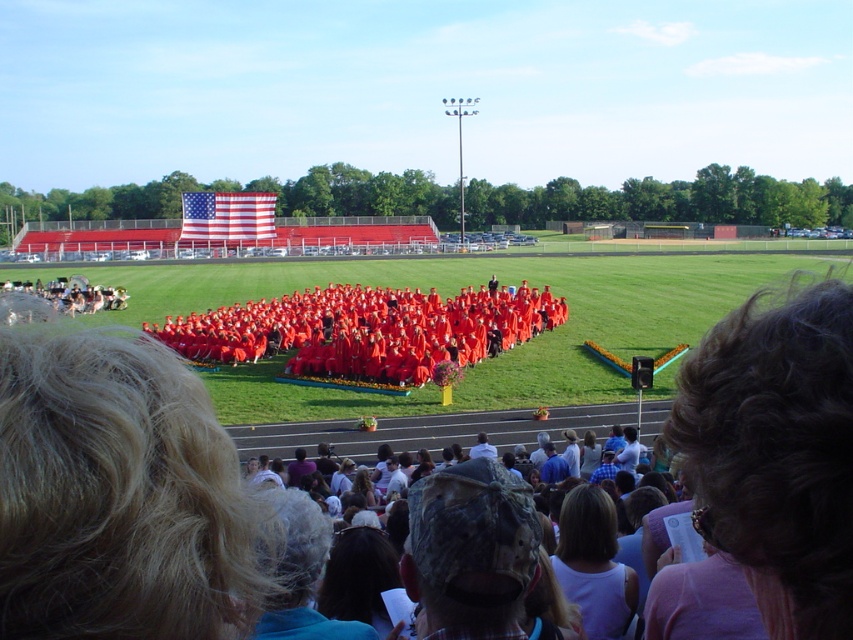
Is dark brown hair at lower right closer to camera compared to light brown hair at lower center?

That is True.

Identify the location of dark brown hair at lower right. (776, 452).

Where is `dark brown hair at lower right`? dark brown hair at lower right is located at coordinates (776, 452).

Can you confirm if blonde hair at lower left is bigger than light brown hair at lower center?

Correct, blonde hair at lower left is larger in size than light brown hair at lower center.

Between point (103, 593) and point (567, 548), which one is positioned behind?

Point (567, 548)

Is point (56, 618) farther from viewer compared to point (613, 604)?

No, it is in front of (613, 604).

Locate an element on the screen. blonde hair at lower left is located at coordinates (117, 493).

Who is shorter, light brown hair at lower center or american flag at upper left?

light brown hair at lower center is shorter.

Does light brown hair at lower center appear on the left side of american flag at upper left?

No, light brown hair at lower center is not to the left of american flag at upper left.

Who is more forward, (606, 589) or (193, 232)?

Point (606, 589) is in front.

Image resolution: width=853 pixels, height=640 pixels. In order to click on light brown hair at lower center in this screenshot , I will do `click(595, 563)`.